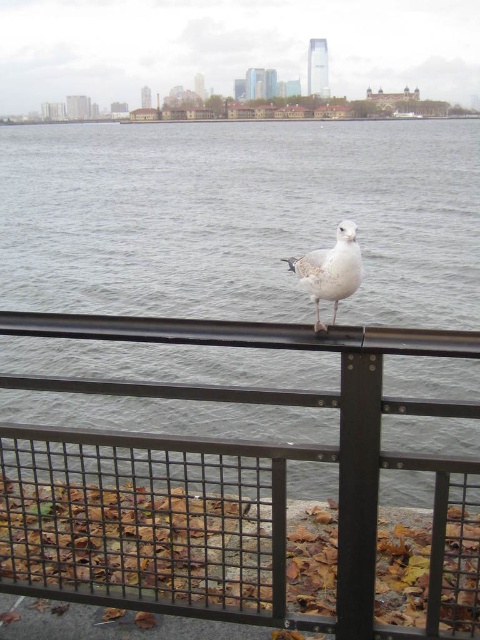
Is point (416, 205) positioned before point (1, 440)?

No, it is not.

Where is `gray water at center`? The height and width of the screenshot is (640, 480). gray water at center is located at coordinates (240, 218).

How much distance is there between gray water at center and white feathered bird at center?

gray water at center and white feathered bird at center are 8.25 meters apart.

Can you confirm if gray water at center is smaller than white feathered bird at center?

No.

The height and width of the screenshot is (640, 480). Describe the element at coordinates (240, 218) in the screenshot. I see `gray water at center` at that location.

This screenshot has height=640, width=480. Identify the location of gray water at center. (240, 218).

Between black metal fence at center and white feathered bird at center, which one is positioned lower?

black metal fence at center is lower down.

Is black metal fence at center positioned behind white feathered bird at center?

Yes, it is.

Is point (216, 340) farther from camera compared to point (303, 259)?

No, (216, 340) is in front of (303, 259).

At what (x,y) coordinates should I click in order to perform the action: click on black metal fence at center. Please return your answer as a coordinate pair (x, y). Looking at the image, I should click on (235, 481).